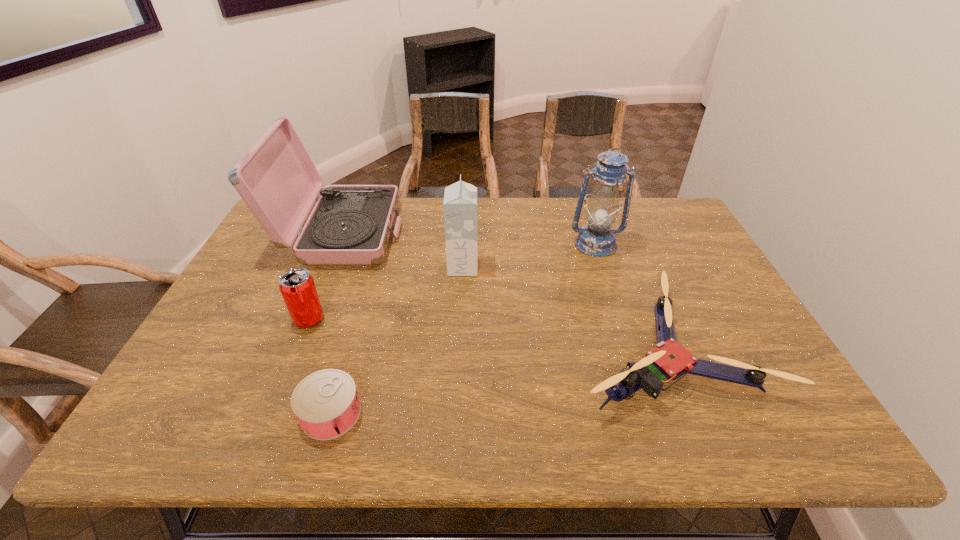
You are a GUI agent. You are given a task and a screenshot of the screen. Output one action in this format:
    pyautogui.click(x=<x>, y=<y>)
    Task: Click on the lantern
    This screenshot has width=960, height=540.
    Given the screenshot: What is the action you would take?
    pyautogui.click(x=597, y=239)

Where is `record player`? record player is located at coordinates (350, 224).

This screenshot has width=960, height=540. Find the location of `the third object from right to left`. the third object from right to left is located at coordinates (460, 199).

Find the location of a particular element. This screenshot has height=540, width=960. soda can is located at coordinates (296, 285).

I want to click on drone, so click(x=669, y=360).

Find the location of a particular element. The image size is (960, 540). can is located at coordinates pyautogui.click(x=326, y=404).

Locate an element on the screen. The width and height of the screenshot is (960, 540). vacant space positioned 0.290m on the front-facing side of the lantern is located at coordinates pos(623,329).

This screenshot has width=960, height=540. I want to click on free spot located 0.080m with the lid open on the record player, so click(x=425, y=233).

Find the location of `vacant area situated on the front label of the carton`. vacant area situated on the front label of the carton is located at coordinates (588, 267).

Locate an element on the screen. vacant area located on the left of the soda can is located at coordinates (254, 320).